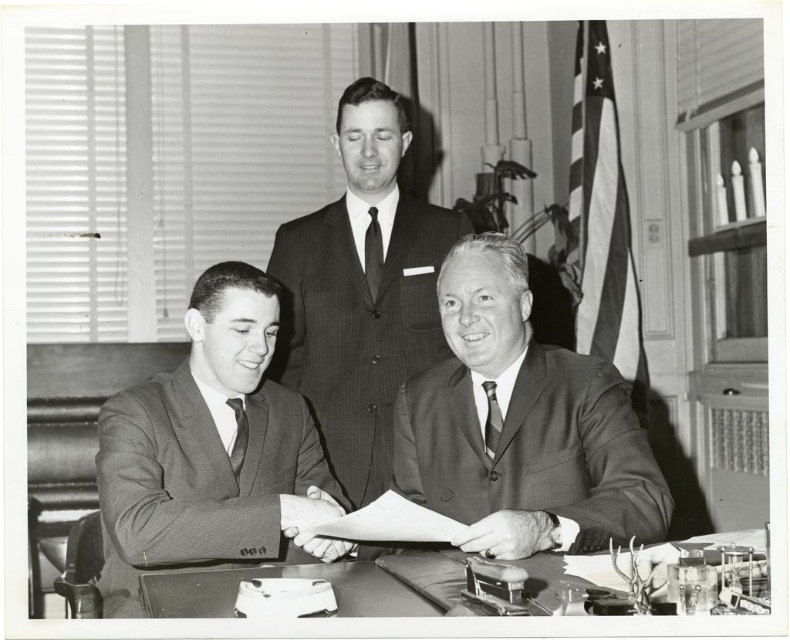
Can you confirm if smooth brown suit at center is smaller than black silk tie at center?

Incorrect, smooth brown suit at center is not smaller in size than black silk tie at center.

Does smooth brown suit at center appear over black silk tie at center?

No, smooth brown suit at center is not above black silk tie at center.

Which is behind, point (529, 372) or point (371, 300)?

Positioned behind is point (371, 300).

Where is `smooth brown suit at center`? The width and height of the screenshot is (790, 640). smooth brown suit at center is located at coordinates (521, 424).

Does smooth brown suit at center appear under checkered fabric suit at lower left?

Actually, smooth brown suit at center is above checkered fabric suit at lower left.

Is smooth brown suit at center taller than checkered fabric suit at lower left?

No, smooth brown suit at center is not taller than checkered fabric suit at lower left.

Between point (412, 465) and point (322, 456), which one is positioned in front?

Point (412, 465) is more forward.

Identify the location of smooth brown suit at center. The height and width of the screenshot is (640, 790). (521, 424).

Is smooth suit at center behind dark gray textured tie at center?

That is True.

Is point (431, 321) closer to camera compared to point (491, 442)?

That is False.

This screenshot has height=640, width=790. What are the coordinates of `smooth suit at center` in the screenshot? It's located at (360, 292).